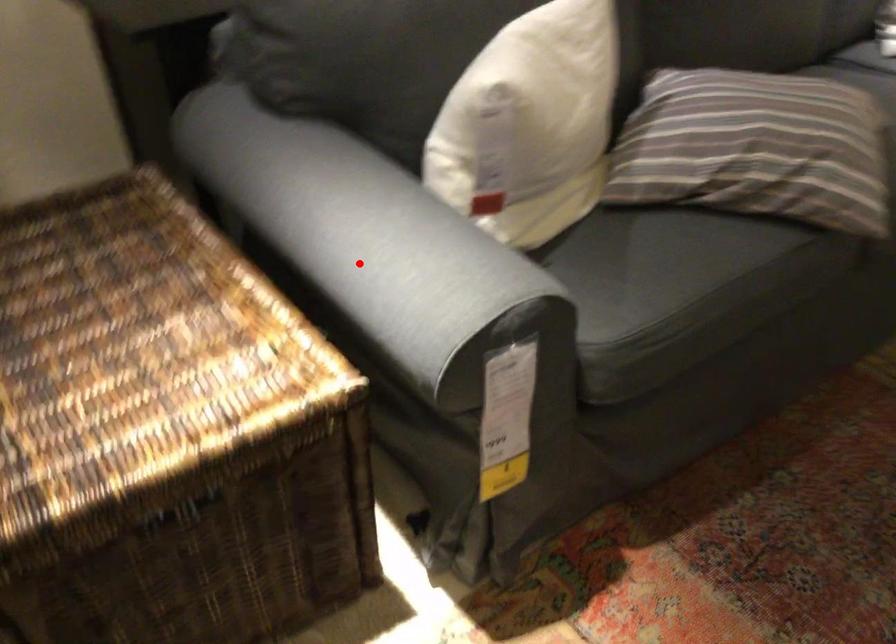
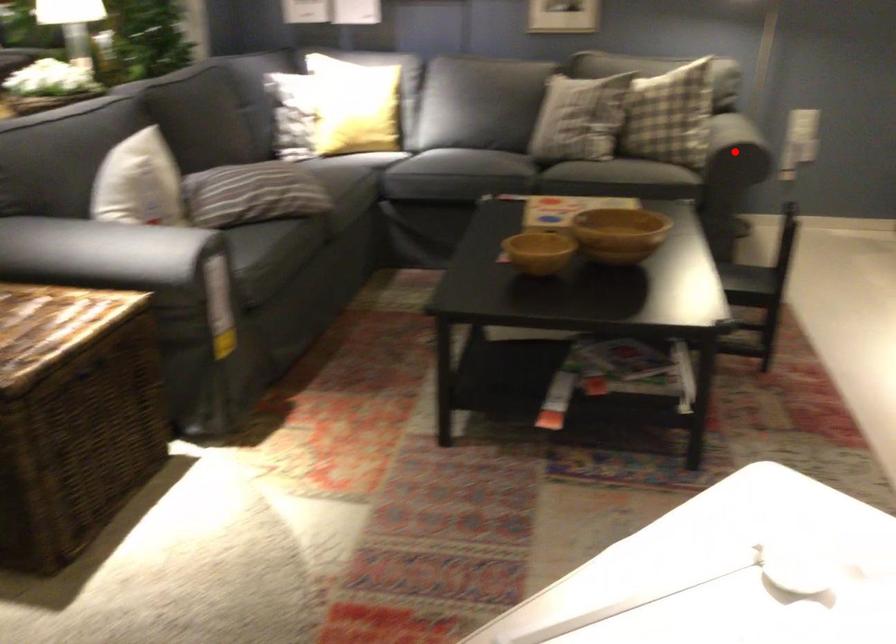
I am providing you with two images of the same scene from different viewpoints. A red point is marked on the first image and another point is marked on the second image. Is the marked point in image1 the same physical position as the marked point in image2?

No